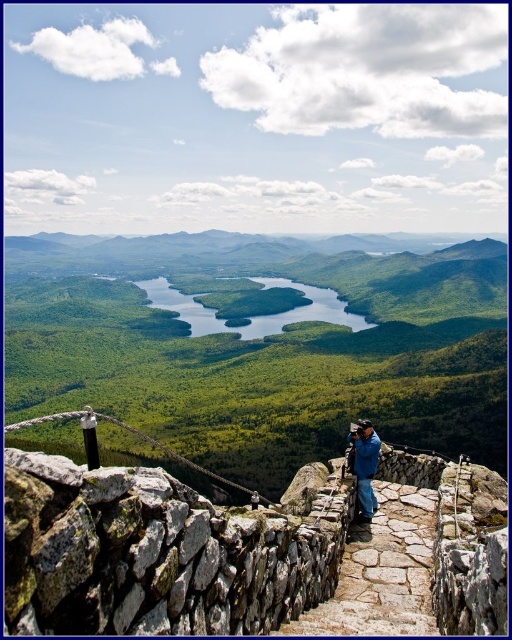
Question: Can you confirm if gray rough stone at center is bigger than blue fabric jacket at lower center?

Choices:
 (A) no
 (B) yes

Answer: (B)

Question: Which object is the farthest from the green grassy valley at center?

Choices:
 (A) gray rough stone at center
 (B) blue glossy water at center
 (C) blue fabric jacket at lower center

Answer: (C)

Question: Can you confirm if gray rough stone at center is bigger than blue glossy water at center?

Choices:
 (A) yes
 (B) no

Answer: (B)

Question: Estimate the real-world distances between objects in this image. Which object is farther from the blue fabric jacket at lower center?

Choices:
 (A) blue glossy water at center
 (B) green grassy valley at center

Answer: (A)

Question: Among these objects, which one is farthest from the camera?

Choices:
 (A) blue glossy water at center
 (B) blue fabric jacket at lower center

Answer: (A)

Question: Is blue glossy water at center positioned in front of blue fabric jacket at lower center?

Choices:
 (A) no
 (B) yes

Answer: (A)